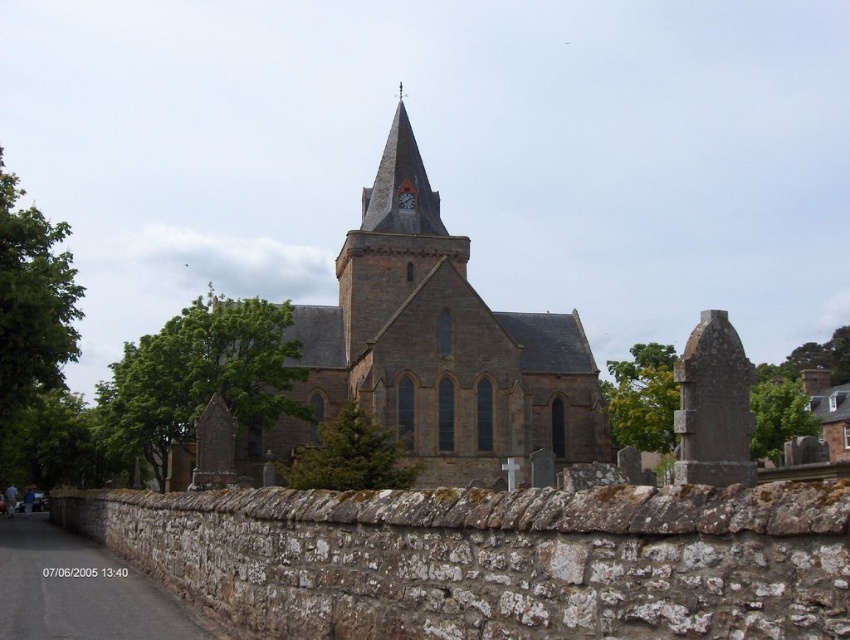
Question: Which of the following is the closest to the observer?

Choices:
 (A) (400, 195)
 (B) (398, 148)
 (C) (449, 435)

Answer: (C)

Question: Observing the image, what is the correct spatial positioning of brick steeple at center in reference to matte stone clock at upper center?

Choices:
 (A) right
 (B) left

Answer: (B)

Question: Which object appears closest to the camera in this image?

Choices:
 (A) brick steeple at center
 (B) brown stone church at center
 (C) matte stone clock at upper center

Answer: (B)

Question: Observing the image, what is the correct spatial positioning of brown stone church at center in reference to matte stone clock at upper center?

Choices:
 (A) left
 (B) right

Answer: (A)

Question: Is brown stone church at center below brick steeple at center?

Choices:
 (A) no
 (B) yes

Answer: (B)

Question: Which object appears closest to the camera in this image?

Choices:
 (A) brown stone church at center
 (B) brick steeple at center

Answer: (A)